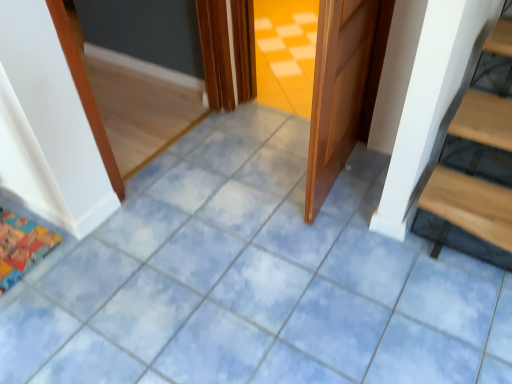
I want to click on free spot below brown wooden door at center (from a real-world perspective), so click(x=342, y=171).